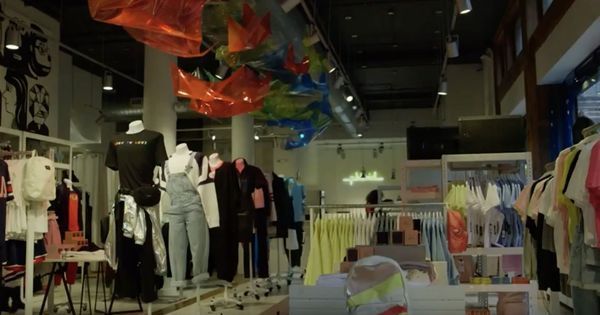
This screenshot has height=315, width=600. I want to click on floor, so click(x=261, y=306).